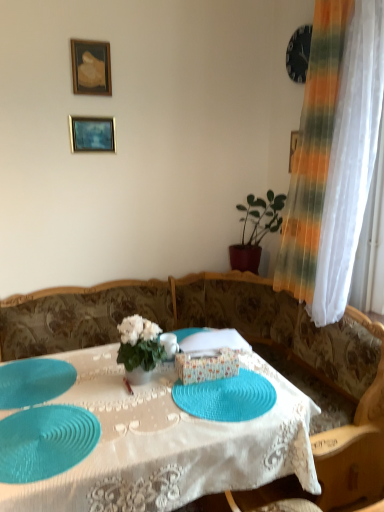
Where is `vacant space situated on the left part of teal woven placemat at center, the 3th glass plate positioned from the left`? The image size is (384, 512). vacant space situated on the left part of teal woven placemat at center, the 3th glass plate positioned from the left is located at coordinates pos(132,410).